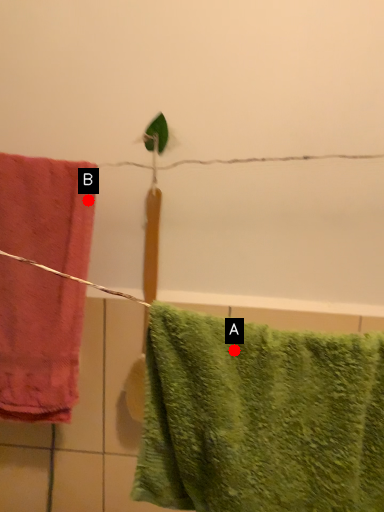
Question: Two points are circled on the image, labeled by A and B beside each circle. Which of the following is the farthest from the observer?

Choices:
 (A) A is further
 (B) B is further

Answer: (B)